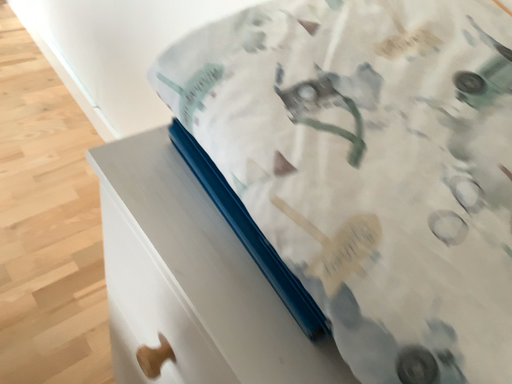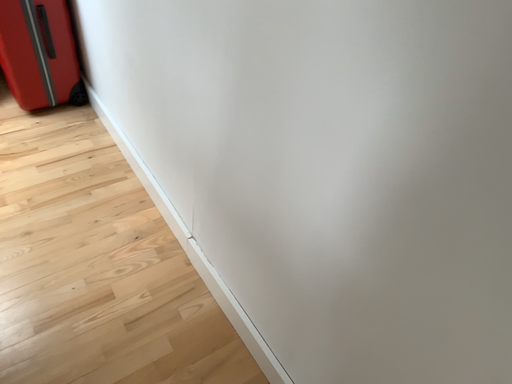
Question: Which way did the camera rotate in the video?

Choices:
 (A) rotated upward
 (B) rotated downward

Answer: (A)